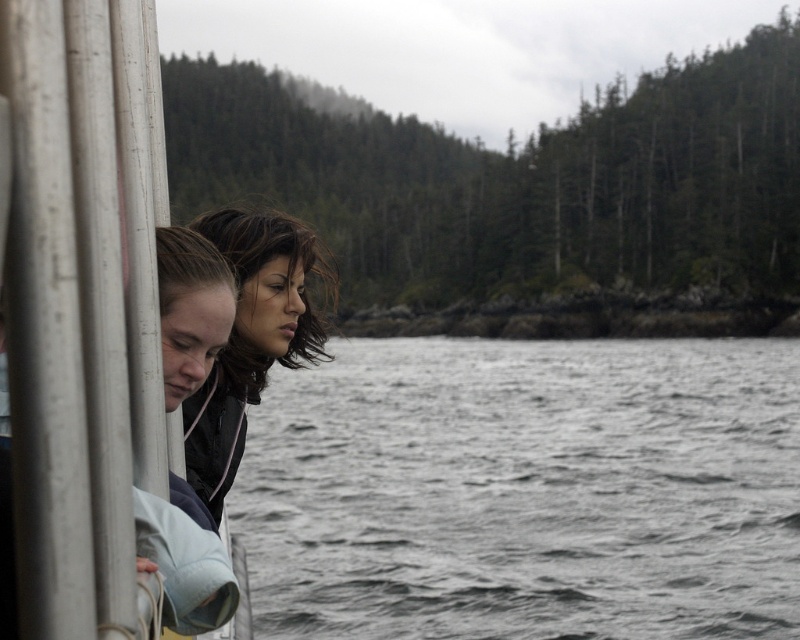
Does gray water at center appear over matte black jacket at center?

No.

Is point (418, 356) less distant than point (256, 308)?

No.

Identify the location of gray water at center. The image size is (800, 640). (526, 490).

Is metallic silver boat at left shorter than matte black jacket at center?

Indeed, metallic silver boat at left has a lesser height compared to matte black jacket at center.

Looking at this image, is metallic silver boat at left further to camera compared to matte black jacket at center?

No, metallic silver boat at left is closer to the viewer.

Is point (36, 492) more distant than point (290, 326)?

No.

I want to click on metallic silver boat at left, so click(82, 307).

Where is `gray water at center`? This screenshot has height=640, width=800. gray water at center is located at coordinates (526, 490).

Between gray water at center and metallic silver boat at left, which one appears on the right side from the viewer's perspective?

From the viewer's perspective, gray water at center appears more on the right side.

Is point (348, 516) positioned before point (64, 582)?

That is False.

The image size is (800, 640). I want to click on gray water at center, so click(526, 490).